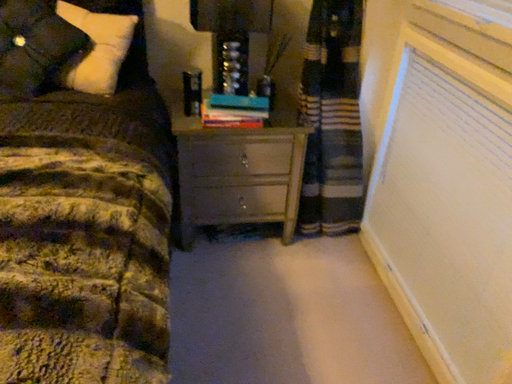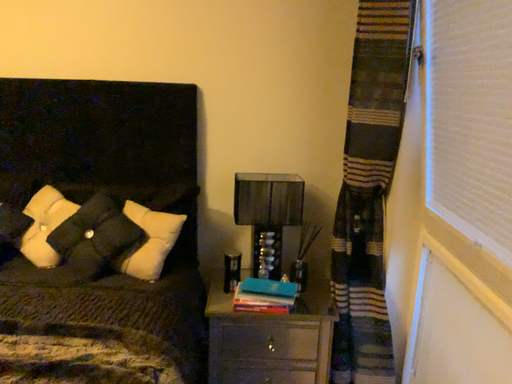
Question: How did the camera likely rotate when shooting the video?

Choices:
 (A) rotated left
 (B) rotated right

Answer: (A)